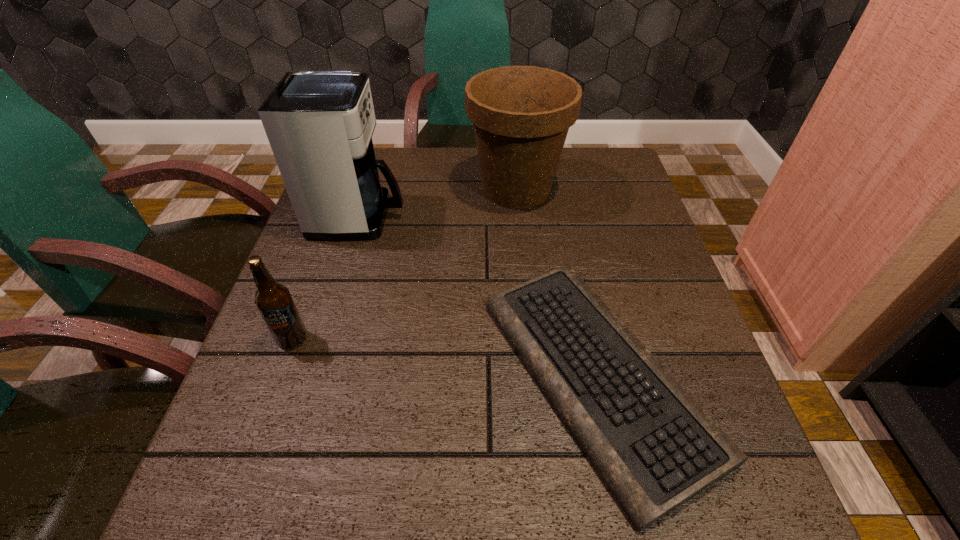
What are the coordinates of `vacant space at the far left corner of the desktop` in the screenshot? It's located at pyautogui.click(x=380, y=179).

Locate an element on the screen. Image resolution: width=960 pixels, height=540 pixels. free space at the near left corner of the desktop is located at coordinates (294, 504).

In the image, there is a desktop. Where is `free space at the far right corner`? Image resolution: width=960 pixels, height=540 pixels. free space at the far right corner is located at coordinates (591, 171).

At what (x,y) coordinates should I click in order to perform the action: click on vacant area at the near right corner. Please return your answer as a coordinate pair (x, y). Image resolution: width=960 pixels, height=540 pixels. Looking at the image, I should click on (766, 532).

At what (x,y) coordinates should I click in order to perform the action: click on empty location between the tallest object and the beer bottle. Please return your answer as a coordinate pair (x, y). Looking at the image, I should click on (326, 278).

The width and height of the screenshot is (960, 540). Identify the location of vacant space that's between the coffee maker and the shortest object. (478, 297).

Where is `vacant area that lies between the coffee maker and the computer keyboard`? vacant area that lies between the coffee maker and the computer keyboard is located at coordinates (478, 297).

Locate an element on the screen. Image resolution: width=960 pixels, height=540 pixels. empty space that is in between the coffee maker and the shortest object is located at coordinates (478, 297).

You are a GUI agent. You are given a task and a screenshot of the screen. Output one action in this format:
    pyautogui.click(x=<x>, y=<y>)
    Task: Click on the unoccupied area between the beer bottle and the second tallest object
    The image size is (960, 540).
    Given the screenshot: What is the action you would take?
    pyautogui.click(x=404, y=264)

The image size is (960, 540). Find the location of `vacant area that lies between the coffee maker and the computer keyboard`. vacant area that lies between the coffee maker and the computer keyboard is located at coordinates (478, 297).